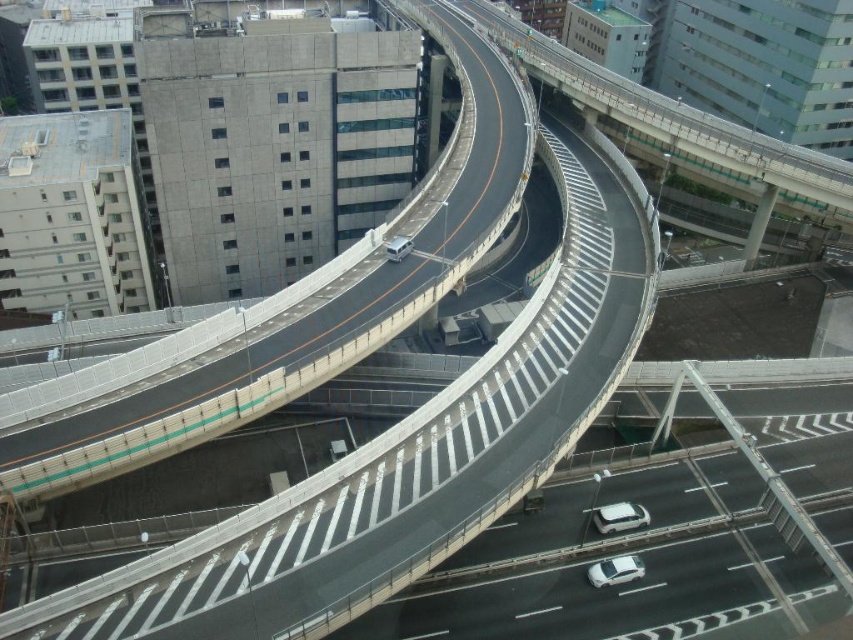
Consider the image. Can you confirm if smooth asphalt highway at center is shorter than white matte car at center?

No, smooth asphalt highway at center is not shorter than white matte car at center.

Between point (755, 561) and point (619, 568), which one is positioned behind?

The point (755, 561) is behind.

Identify the location of smooth asphalt highway at center. (619, 552).

Between point (465, 272) and point (396, 248), which one is positioned in front?

Point (396, 248)

Is point (393, 332) positioned in front of point (387, 253)?

Yes, point (393, 332) is in front of point (387, 253).

This screenshot has height=640, width=853. I want to click on concrete bridge at center, so click(x=286, y=308).

Is point (630, 563) positioned after point (410, 244)?

No, it is in front of (410, 244).

Between point (599, 566) and point (392, 252), which one is positioned behind?

Point (392, 252)

Locate an element on the screen. white matte car at center is located at coordinates (614, 570).

Find the location of a particular element. The height and width of the screenshot is (640, 853). white matte car at center is located at coordinates (614, 570).